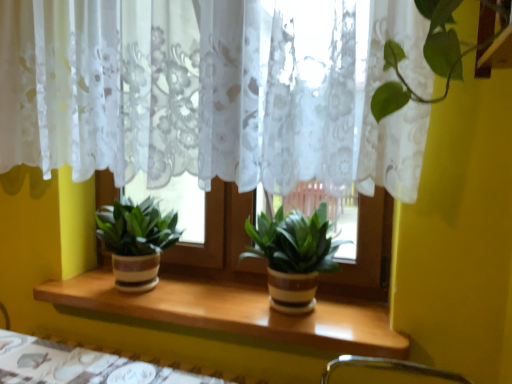
Describe the element at coordinates (293, 256) in the screenshot. The height and width of the screenshot is (384, 512). I see `green matte plant at center, which ranks as the first houseplant in right-to-left order` at that location.

Locate an element on the screen. The height and width of the screenshot is (384, 512). green matte plant at center, which is counted as the first houseplant, starting from the left is located at coordinates (136, 241).

At what (x,y) coordinates should I click in order to perform the action: click on white lace curtain at center. Please return your answer as a coordinate pair (x, y). Looking at the image, I should click on (213, 91).

Can you tell me how much white lace curtain at center and green matte plant at center, which is counted as the first houseplant, starting from the left, differ in facing direction?

There is a 0.000405-degree angle between the facing directions of white lace curtain at center and green matte plant at center, which is counted as the first houseplant, starting from the left.

Can you confirm if white lace curtain at center is thinner than green matte plant at center, the 2th houseplant viewed from the right?

Correct, the width of white lace curtain at center is less than that of green matte plant at center, the 2th houseplant viewed from the right.

Which object is positioned more to the right, white lace curtain at center or green matte plant at center, which is counted as the first houseplant, starting from the left?

white lace curtain at center is more to the right.

Between point (264, 175) and point (142, 251), which one is positioned behind?

The point (142, 251) is behind.

Measure the distance between wooden at center and green matte plant at center, which is counted as the first houseplant, starting from the left.

wooden at center and green matte plant at center, which is counted as the first houseplant, starting from the left, are 9.72 inches apart from each other.

From the image's perspective, does wooden at center appear lower than green matte plant at center, which is counted as the first houseplant, starting from the left?

Yes, from the image's perspective, wooden at center is beneath green matte plant at center, which is counted as the first houseplant, starting from the left.

Is wooden at center looking in the opposite direction of green matte plant at center, the 2th houseplant viewed from the right?

That's not correct — wooden at center is not looking away from green matte plant at center, the 2th houseplant viewed from the right.

Looking at their sizes, would you say wooden at center is wider or thinner than green matte plant at center, the 2th houseplant viewed from the right?

wooden at center is wider than green matte plant at center, the 2th houseplant viewed from the right.

Is green matte plant at center, which ranks as the first houseplant in right-to-left order, shorter than green matte plant at center, the 2th houseplant viewed from the right?

Incorrect, the height of green matte plant at center, which ranks as the first houseplant in right-to-left order, does not fall short of that of green matte plant at center, the 2th houseplant viewed from the right.

From a real-world perspective, which object stands above the other?

In real-world perspective, green matte plant at center, which is counted as the first houseplant, starting from the left, is above.

How many degrees apart are the facing directions of green matte plant at center, which ranks as the first houseplant in right-to-left order, and green matte plant at center, the 2th houseplant viewed from the right?

The angle between the facing direction of green matte plant at center, which ranks as the first houseplant in right-to-left order, and the facing direction of green matte plant at center, the 2th houseplant viewed from the right, is 0.00113 degrees.

Is point (249, 232) farther from camera compared to point (149, 230)?

No, (249, 232) is in front of (149, 230).

Considering the sizes of objects wooden table at lower center and white lace curtain at center in the image provided, who is shorter, wooden table at lower center or white lace curtain at center?

Standing shorter between the two is wooden table at lower center.

Is point (49, 360) less distant than point (283, 59)?

No, (49, 360) is behind (283, 59).

Is wooden table at lower center positioned with its back to white lace curtain at center?

wooden table at lower center does not have its back to white lace curtain at center.

Which of these two, wooden at center or white lace curtain at center, is smaller?

wooden at center is smaller.

What's the angular difference between wooden at center and white lace curtain at center's facing directions?

The angle between the facing direction of wooden at center and the facing direction of white lace curtain at center is 0.000323 degrees.

Which is behind, point (186, 315) or point (104, 135)?

The point (104, 135) is farther from the camera.

Could you tell me if wooden at center is facing white lace curtain at center?

No.

Which object is closer to the camera, green matte plant at center, which is the 2th houseplant in left-to-right order, or wooden at center?

Positioned in front is wooden at center.

Between green matte plant at center, which is the 2th houseplant in left-to-right order, and wooden at center, which one appears on the right side from the viewer's perspective?

green matte plant at center, which is the 2th houseplant in left-to-right order.

Looking at this image, is green matte plant at center, which ranks as the first houseplant in right-to-left order, next to wooden at center and touching it?

No, green matte plant at center, which ranks as the first houseplant in right-to-left order, is not next to wooden at center.

How far apart are green matte plant at center, which is the 2th houseplant in left-to-right order, and white lace curtain at center?

green matte plant at center, which is the 2th houseplant in left-to-right order, is 16.25 inches from white lace curtain at center.

Identify the location of curtain that is in front of the green matte plant at center, which ranks as the first houseplant in right-to-left order. The height and width of the screenshot is (384, 512). (213, 91).

Between green matte plant at center, which is the 2th houseplant in left-to-right order, and white lace curtain at center, which one has more height?

white lace curtain at center is taller.

Does green matte plant at center, which ranks as the first houseplant in right-to-left order, touch white lace curtain at center?

green matte plant at center, which ranks as the first houseplant in right-to-left order, and white lace curtain at center are not in contact.

In the image, there is a green matte plant at center, which is counted as the first houseplant, starting from the left. In order to click on curtain above it (from the image's perspective) in this screenshot , I will do `click(213, 91)`.

Where is `window sill below the green matte plant at center, the 2th houseplant viewed from the right (from the image's perspective)`? window sill below the green matte plant at center, the 2th houseplant viewed from the right (from the image's perspective) is located at coordinates (234, 309).

Based on their spatial positions, is wooden table at lower center or white lace curtain at center closer to green matte plant at center, the 2th houseplant viewed from the right?

wooden table at lower center.

When comparing their distances from white lace curtain at center, does wooden at center or green matte plant at center, which ranks as the first houseplant in right-to-left order, seem further?

Among the two, wooden at center is located further to white lace curtain at center.

When comparing their distances from green matte plant at center, which ranks as the first houseplant in right-to-left order, does green matte plant at center, which is counted as the first houseplant, starting from the left, or wooden at center seem closer?

wooden at center is positioned closer to the anchor green matte plant at center, which ranks as the first houseplant in right-to-left order.

Estimate the real-world distances between objects in this image. Which object is closer to green matte plant at center, which is the 2th houseplant in left-to-right order, wooden table at lower center or white lace curtain at center?

white lace curtain at center lies closer to green matte plant at center, which is the 2th houseplant in left-to-right order, than the other object.

Looking at this image, looking at the image, which one is located closer to wooden table at lower center, green matte plant at center, which is the 2th houseplant in left-to-right order, or white lace curtain at center?

green matte plant at center, which is the 2th houseplant in left-to-right order, lies closer to wooden table at lower center than the other object.

Which object lies nearer to the anchor point white lace curtain at center, wooden table at lower center or wooden at center?

wooden at center is positioned closer to the anchor white lace curtain at center.

Estimate the real-world distances between objects in this image. Which object is further from white lace curtain at center, wooden at center or green matte plant at center, which is counted as the first houseplant, starting from the left?

wooden at center is further to white lace curtain at center.

Looking at the image, which one is located closer to green matte plant at center, which ranks as the first houseplant in right-to-left order, white lace curtain at center or wooden at center?

Based on the image, wooden at center appears to be nearer to green matte plant at center, which ranks as the first houseplant in right-to-left order.

Locate an element on the screen. The image size is (512, 384). houseplant that lies between white lace curtain at center and green matte plant at center, which is the 2th houseplant in left-to-right order, from top to bottom is located at coordinates (136, 241).

The height and width of the screenshot is (384, 512). What are the coordinates of `window sill between white lace curtain at center and wooden table at lower center in the up-down direction` in the screenshot? It's located at (234, 309).

The height and width of the screenshot is (384, 512). Identify the location of window sill between wooden table at lower center and green matte plant at center, which ranks as the first houseplant in right-to-left order, from left to right. (234, 309).

In order to click on window sill between green matte plant at center, the 2th houseplant viewed from the right, and wooden table at lower center vertically in this screenshot , I will do `click(234, 309)`.